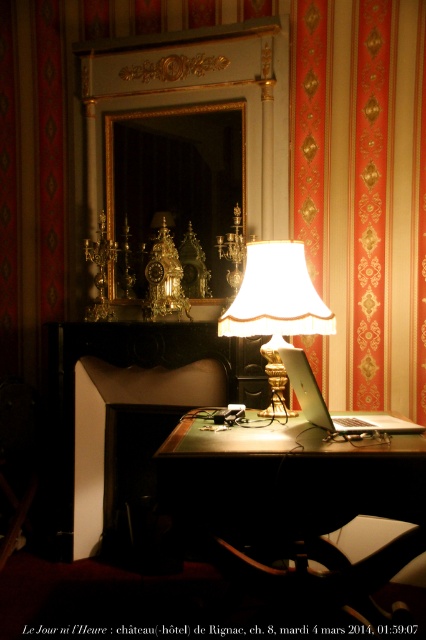
Question: From the image, what is the correct spatial relationship of metallic silver table at center in relation to white fabric lampshade at center?

Choices:
 (A) above
 (B) below

Answer: (B)

Question: Which point appears farthest from the camera in this image?

Choices:
 (A) (336, 428)
 (B) (235, 516)
 (C) (224, 317)

Answer: (C)

Question: Which of the following is the closest to the observer?

Choices:
 (A) satin silver laptop at center
 (B) white fabric lampshade at center

Answer: (A)

Question: Is white fabric lampshade at center to the left of satin silver laptop at center from the viewer's perspective?

Choices:
 (A) yes
 (B) no

Answer: (A)

Question: Where is metallic silver table at center located in relation to white fabric lampshade at center in the image?

Choices:
 (A) above
 (B) below

Answer: (B)

Question: Among these points, which one is nearest to the camera?

Choices:
 (A) (417, 432)
 (B) (242, 550)

Answer: (A)